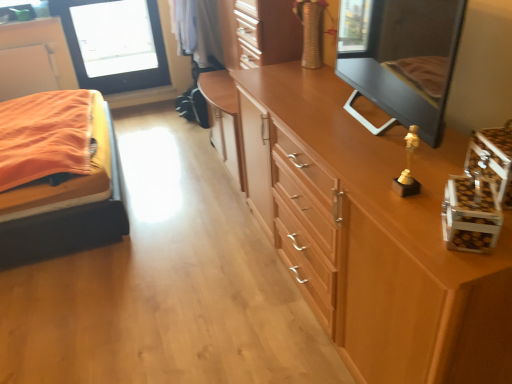
Question: From the image's perspective, is transparent glass window screen at upper left positioned above or below wooden dresser at center?

Choices:
 (A) above
 (B) below

Answer: (A)

Question: Does point (131, 82) appear closer or farther from the camera than point (267, 13)?

Choices:
 (A) farther
 (B) closer

Answer: (A)

Question: Based on their relative distances, which object is farther from the transparent glass window screen at upper left?

Choices:
 (A) matte black mirror at upper right
 (B) orange fabric bed at left
 (C) wooden dresser at center
 (D) light brown wood chest of drawers at upper right

Answer: (A)

Question: Which of these objects is positioned farthest from the transparent glass window screen at upper left?

Choices:
 (A) light brown wood chest of drawers at upper right
 (B) orange fabric bed at left
 (C) matte black mirror at upper right
 (D) wooden dresser at center

Answer: (C)